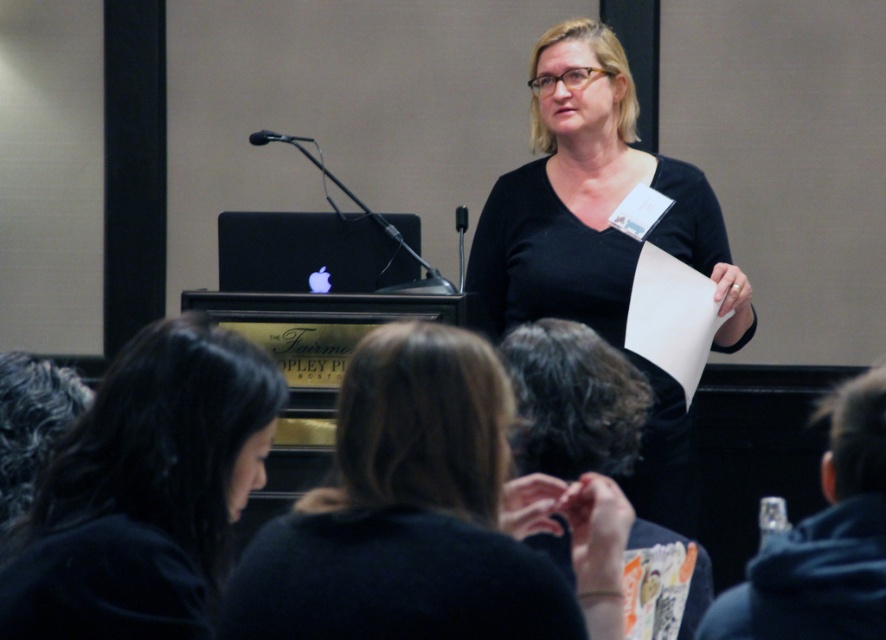
You are an event planner organizing a photoshoot for the conference. You need to decide which object to focus on for a closeup shot. Which one between the black matte shirt at upper center and the black fabric at lower right would appear bigger in the photo?

The black matte shirt at upper center would appear bigger in the photo because it has a larger size compared to the black fabric at lower right.

You are a photographer trying to capture a clear shot of the speaker. You notice the black matte shirt at center and the dark curly hair at lower center in your frame. Which object should you focus on to ensure the subject is in focus?

The black matte shirt at center is taller than dark curly hair at lower center, so focusing on the black matte shirt at center will ensure the subject is in focus as it is the main part of the speaker.

Consider the image. You are a photographer trying to capture a clear photo of the black matte shirt at upper center and the black fabric at lower right. The camera requires both objects to be at least 14 inches apart to focus properly. Based on the scene, can you take the photo as intended?

The black matte shirt at upper center and black fabric at lower right are 12.86 inches apart, which is less than the required 14 inches. Therefore, the camera cannot focus properly on both objects simultaneously.